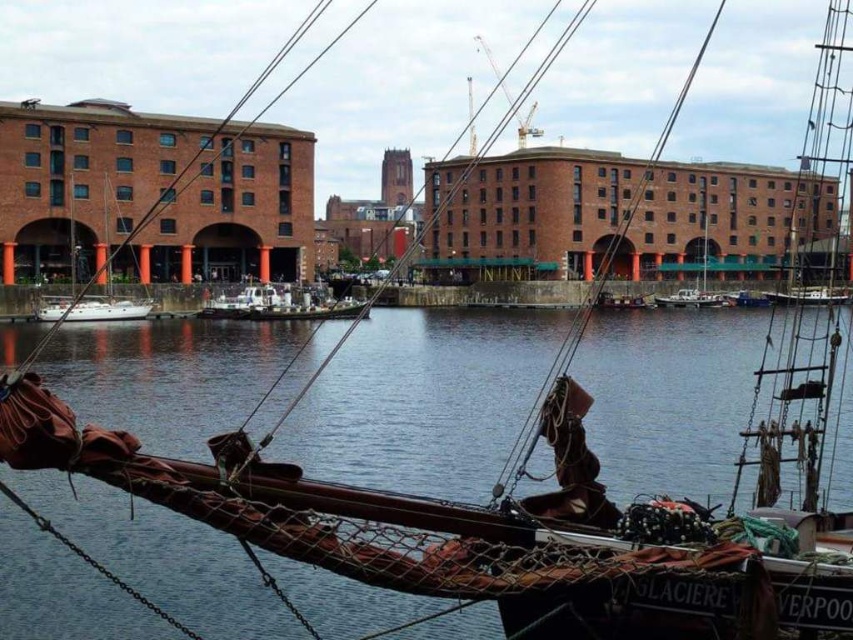
Can you confirm if white matte sailboat at lower left is positioned to the right of white plastic boat at center?

No, white matte sailboat at lower left is not to the right of white plastic boat at center.

Which is in front, point (84, 300) or point (672, 305)?

Point (84, 300) is in front.

Where is `white matte sailboat at lower left`? The width and height of the screenshot is (853, 640). white matte sailboat at lower left is located at coordinates (91, 308).

Measure the distance between transparent water at center and white matte sailboat at left.

A distance of 20.12 meters exists between transparent water at center and white matte sailboat at left.

Describe the element at coordinates (418, 397) in the screenshot. I see `transparent water at center` at that location.

What do you see at coordinates (418, 397) in the screenshot?
I see `transparent water at center` at bounding box center [418, 397].

Where is `transparent water at center`? transparent water at center is located at coordinates (418, 397).

Does white matte sailboat at left appear on the right side of white matte sailboat at lower left?

No, white matte sailboat at left is not to the right of white matte sailboat at lower left.

Between white matte sailboat at left and white matte sailboat at lower left, which one appears on the right side from the viewer's perspective?

Positioned to the right is white matte sailboat at lower left.

Identify the location of white matte sailboat at left. (90, 307).

Where is `white matte sailboat at left`? white matte sailboat at left is located at coordinates (90, 307).